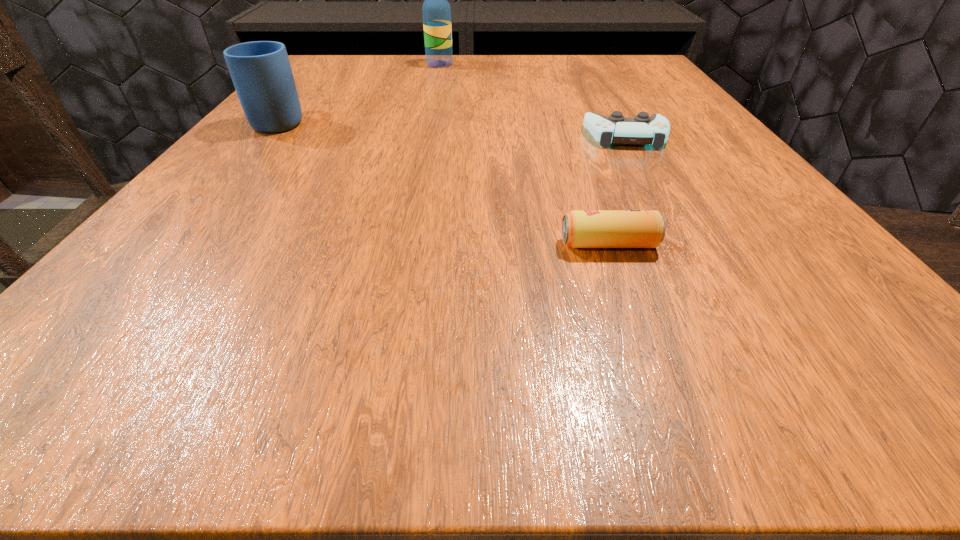
Where is `vacant position located on the left of the nearest object`? vacant position located on the left of the nearest object is located at coordinates (242, 244).

Find the location of a particular element. vacant area located on the back of the control is located at coordinates (583, 59).

Identify the location of object situated at the far edge. The height and width of the screenshot is (540, 960). (436, 11).

I want to click on object located at the left edge, so click(x=261, y=72).

Image resolution: width=960 pixels, height=540 pixels. Identify the location of object located in the right edge section of the desktop. (642, 130).

The height and width of the screenshot is (540, 960). Identify the location of vacant space at the far edge of the desktop. (505, 58).

In the image, there is a desktop. Where is `vacant region at the near edge`? This screenshot has height=540, width=960. vacant region at the near edge is located at coordinates point(320,368).

Locate an element on the screen. Image resolution: width=960 pixels, height=540 pixels. blank area at the left edge is located at coordinates (312, 143).

You are a GUI agent. You are given a task and a screenshot of the screen. Output one action in this format:
    pyautogui.click(x=<x>, y=<y>)
    Task: Click on the free space at the right edge
    
    Given the screenshot: What is the action you would take?
    pyautogui.click(x=721, y=202)

Find the location of a particular element. This screenshot has height=540, width=960. blank space at the far right corner of the desktop is located at coordinates (595, 80).